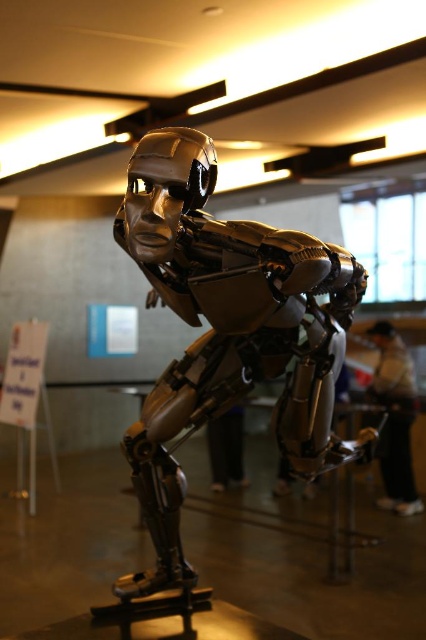
You are a fashion designer who wants to create a matching outfit for the humanoid robot in the image. Based on the distance between the dark gray fabric jacket at lower right and the black matte pants at lower center, can you determine if they are positioned close enough to form a cohesive outfit when worn together?

The dark gray fabric jacket at lower right and black matte pants at lower center are 17.70 inches apart from each other. Since this distance is typical for the separation between upper and lower garments on a humanoid figure, they can form a cohesive outfit when worn together.

You are standing in front of the metallic gold robot at center and the black matte pants at lower center. Which object is positioned to the left?

The black matte pants at lower center is positioned to the left of the metallic gold robot at center.

You are standing in front of the humanoid robot and notice a specific point at coordinates point (394, 419). Based on the scene description, can you determine what object this point is located on?

The point (394, 419) is located on the dark gray fabric jacket at lower right.